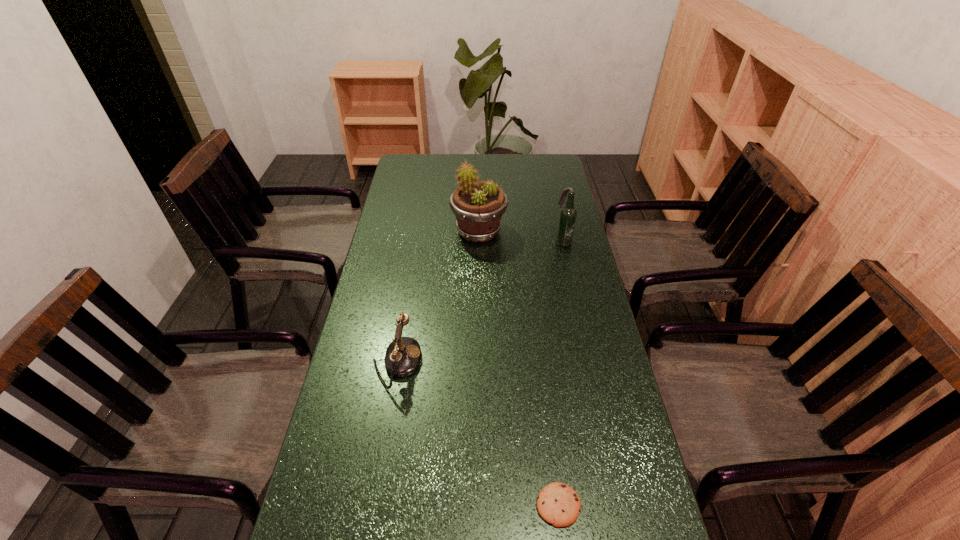
Where is `vacant area that lies between the flowerpot and the second object from right to left`? vacant area that lies between the flowerpot and the second object from right to left is located at coordinates coord(518,368).

Where is `vacant space in between the flowerpot and the second shortest object`? The image size is (960, 540). vacant space in between the flowerpot and the second shortest object is located at coordinates (438, 297).

Where is `blank region between the third farthest object and the shortest object`? This screenshot has height=540, width=960. blank region between the third farthest object and the shortest object is located at coordinates pyautogui.click(x=477, y=434).

Find the location of a particular element. The height and width of the screenshot is (540, 960). free spot between the beer bottle and the cookie is located at coordinates 561,373.

Where is `unoccupied area between the third object from left to right and the third shortest object`? The image size is (960, 540). unoccupied area between the third object from left to right and the third shortest object is located at coordinates (561, 373).

Image resolution: width=960 pixels, height=540 pixels. What are the coordinates of `free area in between the tallest object and the second tallest object` in the screenshot? It's located at (520, 237).

This screenshot has width=960, height=540. I want to click on empty space between the rightmost object and the tallest object, so click(x=520, y=237).

Choose which object is the nearest neighbor to the flowerpot. Please provide its 2D coordinates. Your answer should be formatted as a tuple, i.e. [(x, y)], where the tuple contains the x and y coordinates of a point satisfying the conditions above.

[(567, 219)]

Locate which object is the third closest to the rightmost object. Please provide its 2D coordinates. Your answer should be formatted as a tuple, i.e. [(x, y)], where the tuple contains the x and y coordinates of a point satisfying the conditions above.

[(558, 504)]

This screenshot has width=960, height=540. I want to click on vacant area in the image that satisfies the following two spatial constraints: 1. on the dial of the second shortest object; 2. on the back side of the cookie, so click(x=372, y=505).